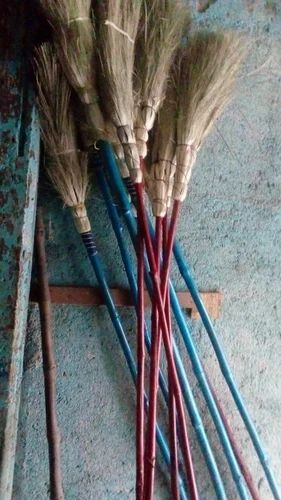
Find the location of a particular element. The width and height of the screenshot is (281, 500). handle is located at coordinates (233, 466).